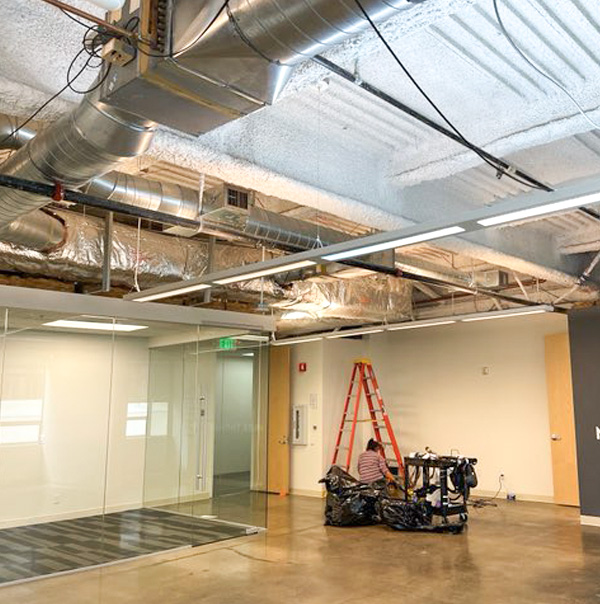
At what (x,y) coordinates should I click in order to perform the action: click on exit sign. Please return your answer as a coordinate pair (x, y). This screenshot has height=604, width=600. Looking at the image, I should click on 228,342.